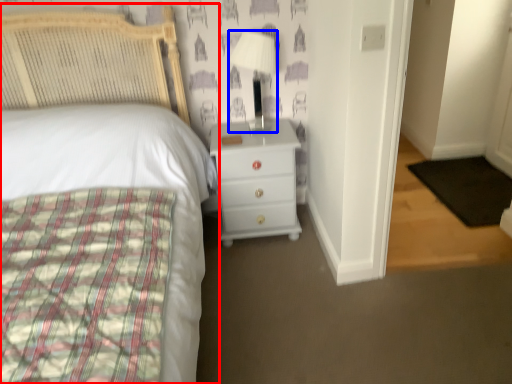
Question: Which object is closer to the camera taking this photo, bed (highlighted by a red box) or lamp (highlighted by a blue box)?

Choices:
 (A) bed
 (B) lamp

Answer: (A)